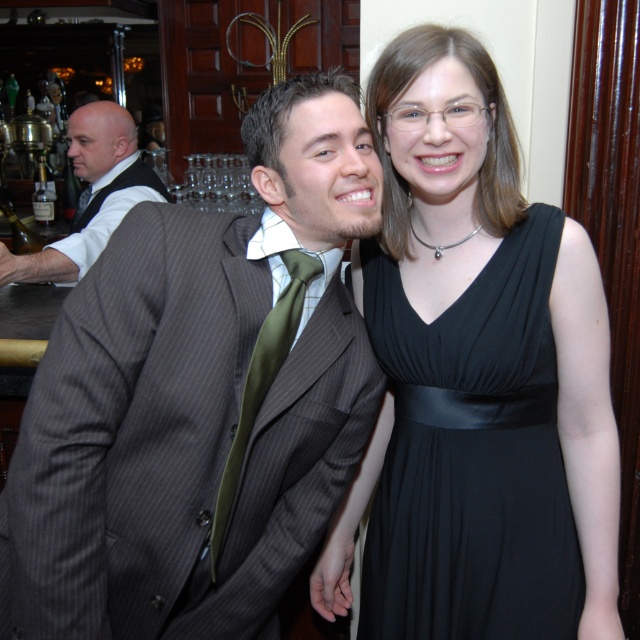
Who is more distant from viewer, (60, 536) or (108, 129)?

The point (108, 129) is behind.

Does dark gray pinstripe suit at center have a lesser height compared to white shirt at left?

Incorrect, dark gray pinstripe suit at center's height does not fall short of white shirt at left's.

Is point (90, 324) closer to camera compared to point (81, 250)?

Yes, it is in front of point (81, 250).

I want to click on dark gray pinstripe suit at center, so click(x=200, y=397).

Is dark gray pinstripe suit at center closer to the viewer compared to black satin dress at center?

Yes, it is in front of black satin dress at center.

Which is in front, point (10, 538) or point (368, 244)?

Point (10, 538) is in front.

Between point (248, 376) and point (536, 516), which one is positioned behind?

The point (536, 516) is behind.

Find the location of a particular element. The height and width of the screenshot is (640, 640). dark gray pinstripe suit at center is located at coordinates (200, 397).

Does dark gray pinstripe suit at center come in front of green silk tie at center?

Yes, dark gray pinstripe suit at center is in front of green silk tie at center.

In order to click on dark gray pinstripe suit at center in this screenshot , I will do `click(200, 397)`.

Is point (168, 332) closer to viewer compared to point (305, 260)?

That is True.

Image resolution: width=640 pixels, height=640 pixels. Find the location of `dark gray pinstripe suit at center`. dark gray pinstripe suit at center is located at coordinates (200, 397).